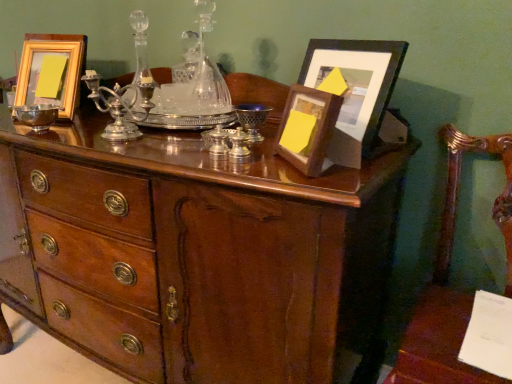
Image resolution: width=512 pixels, height=384 pixels. What are the coordinates of `free space to the left of wooden picture frame at upper right, which is the 2th picture frame from right to left` in the screenshot? It's located at (234, 164).